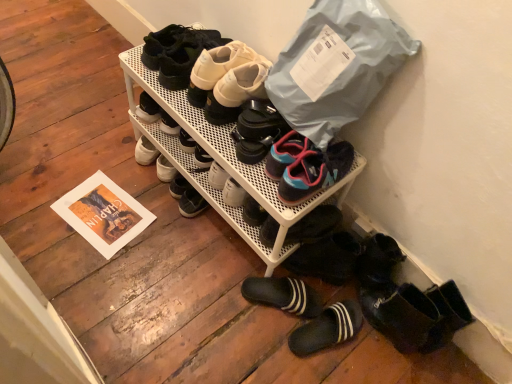
Find the location of a particular element. Image resolution: width=512 pixels, height=384 pixels. free space on the front side of black rubber slipper at lower center, which is the second footwear from bottom to top is located at coordinates (258, 339).